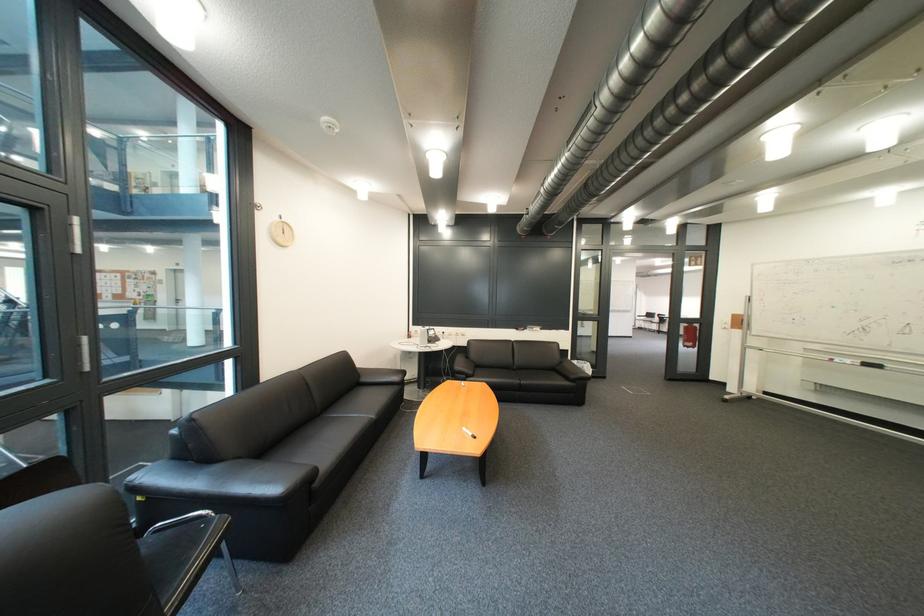
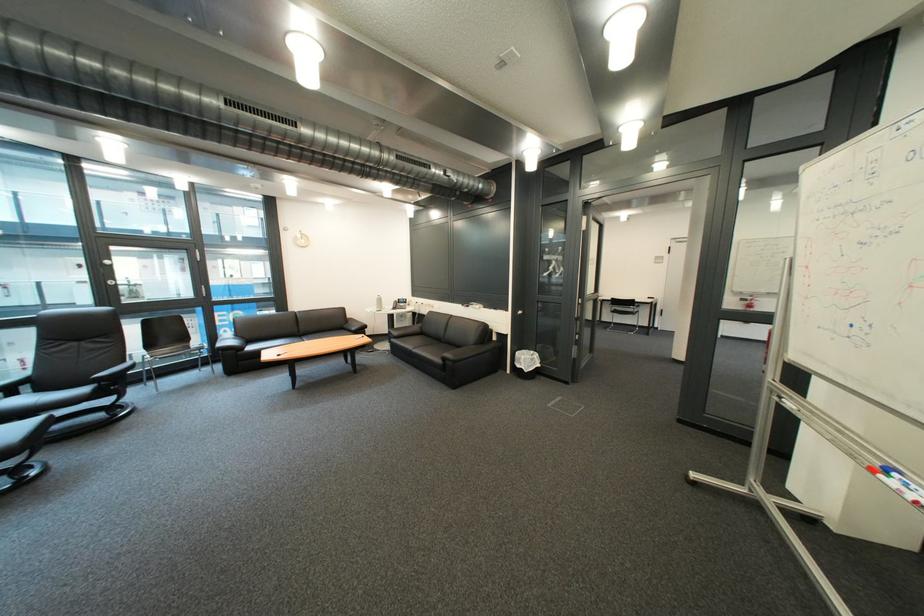
Find the pixel in the second image that matches the point at 845,361 in the first image.

(901, 472)